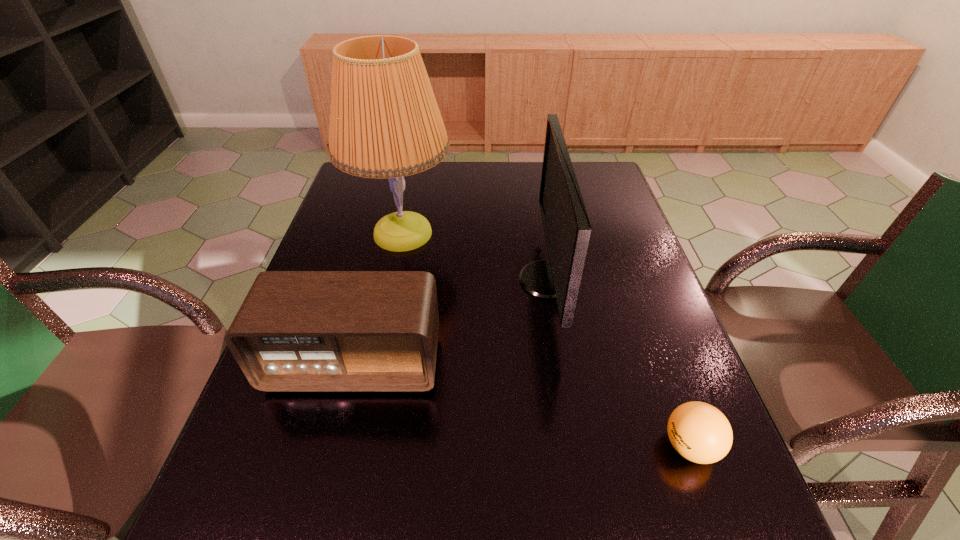
The width and height of the screenshot is (960, 540). What are the coordinates of `lamp` in the screenshot? It's located at (385, 122).

Image resolution: width=960 pixels, height=540 pixels. I want to click on the third shortest object, so click(x=567, y=228).

The height and width of the screenshot is (540, 960). I want to click on computer monitor, so click(x=567, y=228).

Where is `the second shortest object`? The image size is (960, 540). the second shortest object is located at coordinates (296, 330).

The height and width of the screenshot is (540, 960). Identify the location of the rightmost object. (698, 431).

This screenshot has width=960, height=540. I want to click on the shortest object, so click(x=698, y=431).

The width and height of the screenshot is (960, 540). What are the coordinates of `vacant region located 0.100m on the side of the tallest object near the pull switch` in the screenshot? It's located at (489, 234).

Locate an element on the screen. free space located on the front-facing side of the third shortest object is located at coordinates (385, 280).

This screenshot has height=540, width=960. Identify the location of vacant region located 0.080m on the front-facing side of the third shortest object. (489, 280).

This screenshot has height=540, width=960. I want to click on vacant area situated 0.170m on the front-facing side of the third shortest object, so click(454, 280).